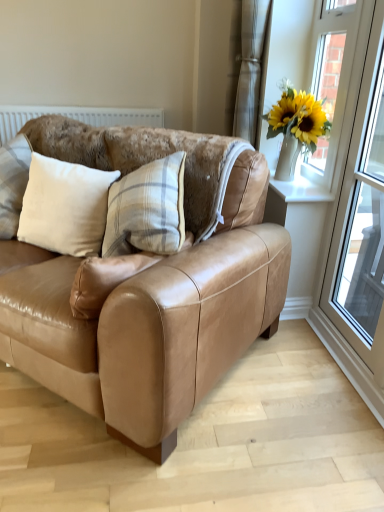
Question: Does tan leather couch at center have a greater height compared to white smooth window sill at upper right?

Choices:
 (A) no
 (B) yes

Answer: (B)

Question: From a real-world perspective, is tan leather couch at center physically above white smooth window sill at upper right?

Choices:
 (A) yes
 (B) no

Answer: (B)

Question: Can you confirm if tan leather couch at center is smaller than white smooth window sill at upper right?

Choices:
 (A) yes
 (B) no

Answer: (B)

Question: Is tan leather couch at center oriented towards white smooth window sill at upper right?

Choices:
 (A) yes
 (B) no

Answer: (B)

Question: Is tan leather couch at center positioned behind white smooth window sill at upper right?

Choices:
 (A) yes
 (B) no

Answer: (B)

Question: From a real-world perspective, is tan leather couch at center positioned above or below white plastic window frame at right?

Choices:
 (A) above
 (B) below

Answer: (B)

Question: From their relative heights in the image, would you say tan leather couch at center is taller or shorter than white plastic window frame at right?

Choices:
 (A) tall
 (B) short

Answer: (B)

Question: Considering the relative positions of tan leather couch at center and white plastic window frame at right in the image provided, is tan leather couch at center to the left or to the right of white plastic window frame at right?

Choices:
 (A) right
 (B) left

Answer: (B)

Question: Choose the correct answer: Is tan leather couch at center inside white plastic window frame at right or outside it?

Choices:
 (A) outside
 (B) inside

Answer: (A)

Question: Looking at the image, does beige fabric pillow at left seem bigger or smaller compared to white smooth window sill at upper right?

Choices:
 (A) big
 (B) small

Answer: (A)

Question: Is beige fabric pillow at left inside the boundaries of white smooth window sill at upper right, or outside?

Choices:
 (A) outside
 (B) inside

Answer: (A)

Question: Considering the positions of point (57, 164) and point (286, 198), is point (57, 164) closer or farther from the camera than point (286, 198)?

Choices:
 (A) closer
 (B) farther

Answer: (A)

Question: Is beige fabric pillow at left wider or thinner than white smooth window sill at upper right?

Choices:
 (A) wide
 (B) thin

Answer: (A)

Question: Considering the positions of point (327, 51) and point (266, 12), is point (327, 51) closer or farther from the camera than point (266, 12)?

Choices:
 (A) farther
 (B) closer

Answer: (A)

Question: Considering their positions, is white glass window at upper right located in front of or behind white textured curtain at upper center?

Choices:
 (A) behind
 (B) front

Answer: (B)